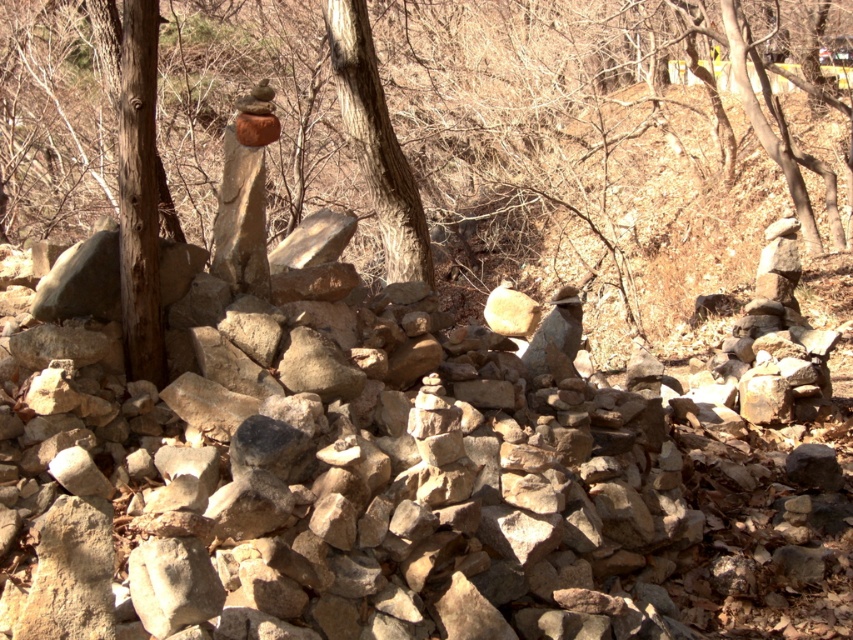
You are standing in the outdoor scene described. There is a smooth brown tree trunk at left. Can you tell me its exact 2D coordinates in the image?

The smooth brown tree trunk at left is located at coordinates (x=575, y=152).

You are an artist planning to sketch the scene. You have two subjects in front of you, the smooth brown tree trunk at left and the smooth brown bark at center. Which one should you choose if you want to draw a larger subject?

The smooth brown tree trunk at left is bigger than the smooth brown bark at center, so you should choose the smooth brown tree trunk at left for a larger subject.

You are standing in the outdoor scene described. You see a point marked at coordinates (138, 195). What is the object located at that point?

The point at coordinates (138, 195) is located on the brown rough wood at left.